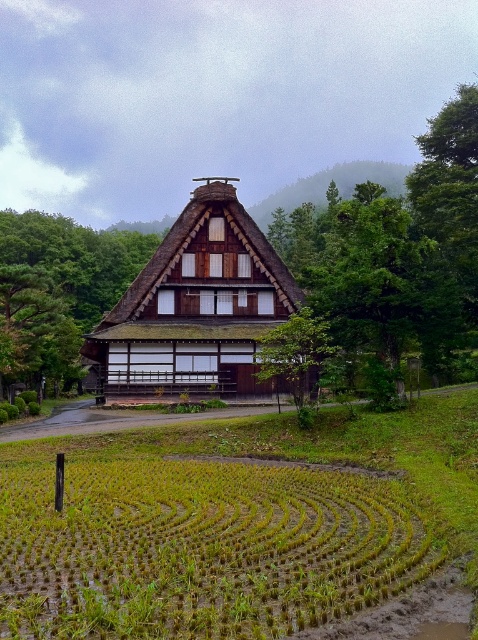
Who is lower down, green grassy rice field at lower center or green leafy hillside at upper center?

green grassy rice field at lower center is below.

Who is positioned more to the right, green grassy rice field at lower center or green leafy hillside at upper center?

green leafy hillside at upper center is more to the right.

Which is in front, point (1, 506) or point (358, 173)?

Positioned in front is point (1, 506).

The width and height of the screenshot is (478, 640). I want to click on green grassy rice field at lower center, so click(x=199, y=548).

Find the location of a particular element. This screenshot has width=478, height=640. thatched roof hut at center is located at coordinates (197, 307).

Does thatched roof hut at center appear on the left side of green leafy hillside at upper center?

Indeed, thatched roof hut at center is positioned on the left side of green leafy hillside at upper center.

Who is more forward, (128, 323) or (317, 198)?

Point (128, 323) is in front.

In order to click on thatched roof hut at center in this screenshot , I will do `click(197, 307)`.

How much distance is there between green grassy rice field at lower center and thatched roof hut at center?

green grassy rice field at lower center and thatched roof hut at center are 71.25 feet apart.

Does point (210, 486) come in front of point (217, 280)?

Yes, it is.

Is point (194, 637) farther from viewer compared to point (252, 330)?

No.

Identify the location of green grassy rice field at lower center. Image resolution: width=478 pixels, height=640 pixels. (199, 548).